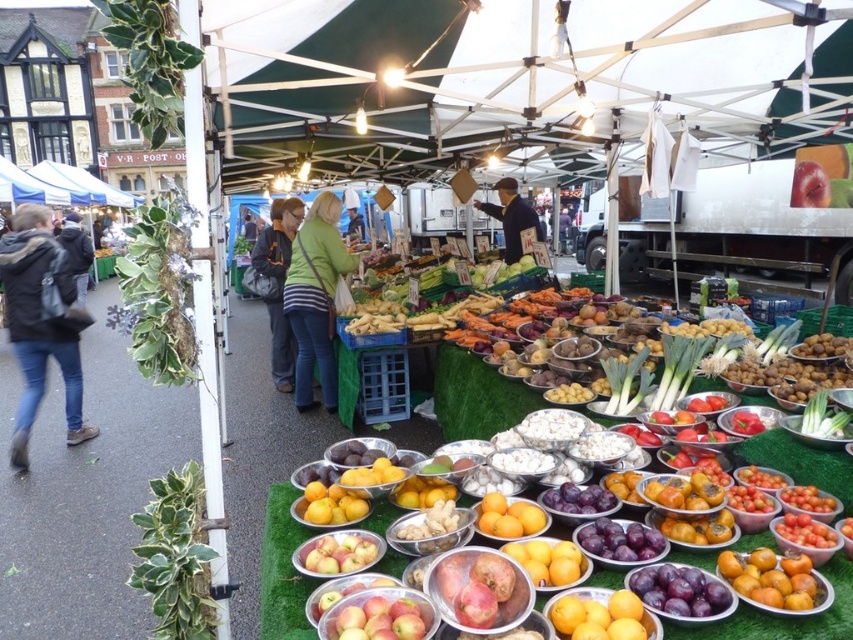
You are a customer at the market and want to find the black leather jacket at left. According to the coordinates provided, where should you look relative to the stall?

The black leather jacket at left is located at coordinates point (39, 323), which is near the left side of the stall.

You are a customer at the market and want to buy a jacket and a shirt. You see the black leather jacket at left and the green striped shirt at center. Which one is located more to the left?

The black leather jacket at left is more to the left than the green striped shirt at center.